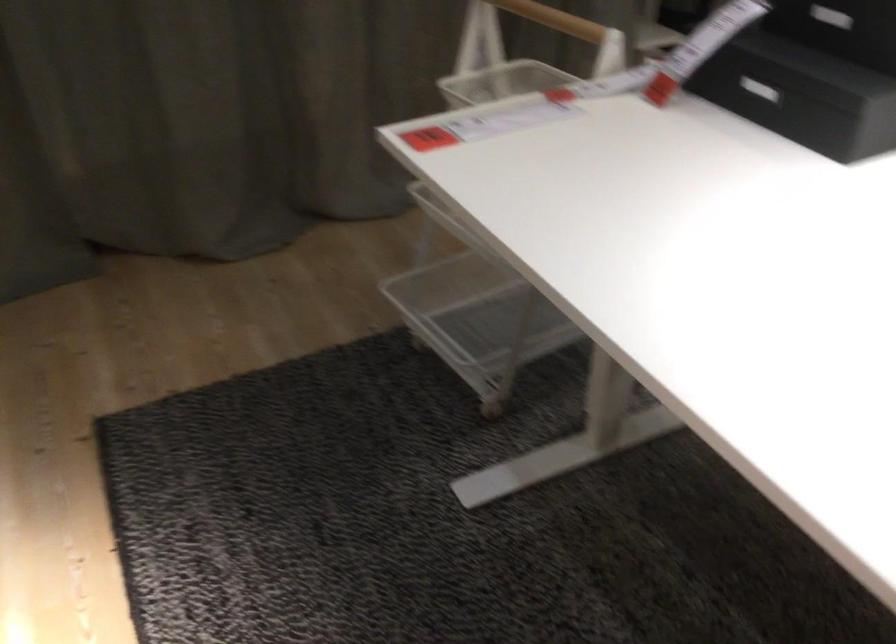
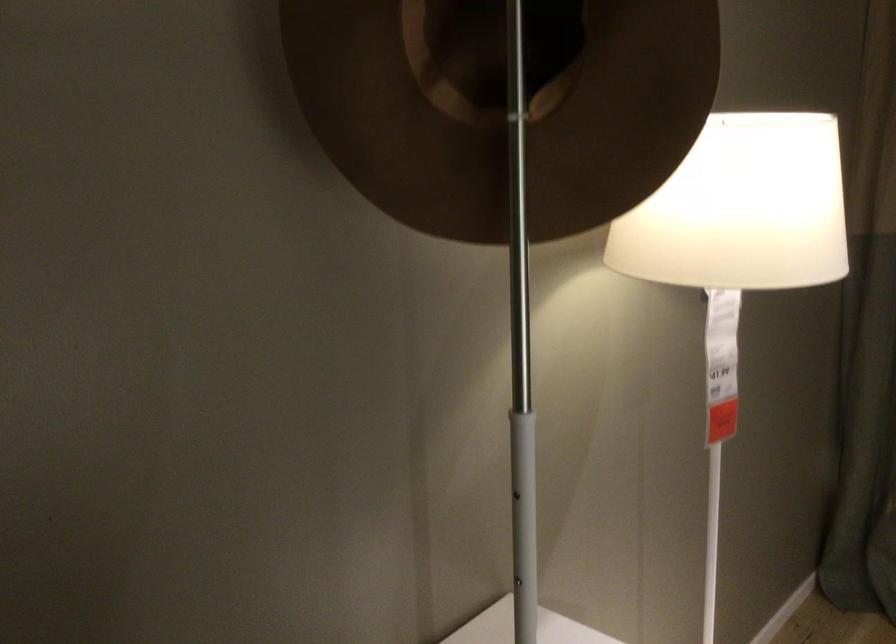
Question: The camera is either moving clockwise (left) or counter-clockwise (right) around the object. The first image is from the beginning of the video and the second image is from the end. Is the camera moving left or right when shooting the video?

Choices:
 (A) Left
 (B) Right

Answer: (B)